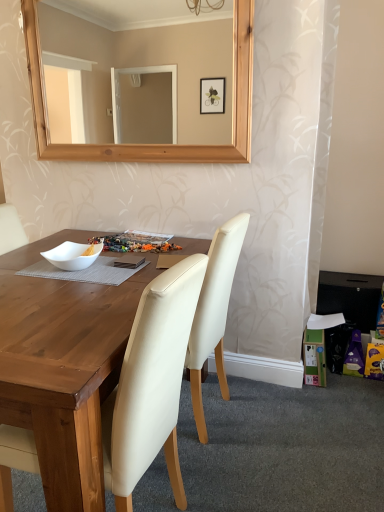
Question: In which direction should I rotate to look at cream leather chair at center, the second chair viewed from the front?

Choices:
 (A) right
 (B) left

Answer: (B)

Question: Considering the relative sizes of cream leather chair at center, which is counted as the first chair, starting from the front, and cream leather chair at center, the first chair viewed from the back, in the image provided, is cream leather chair at center, which is counted as the first chair, starting from the front, smaller than cream leather chair at center, the first chair viewed from the back,?

Choices:
 (A) yes
 (B) no

Answer: (B)

Question: Is cream leather chair at center, which is counted as the first chair, starting from the front, aimed at cream leather chair at center, the second chair viewed from the front?

Choices:
 (A) no
 (B) yes

Answer: (A)

Question: From a real-world perspective, is cream leather chair at center, arranged as the 2th chair when viewed from the back, over cream leather chair at center, the second chair viewed from the front?

Choices:
 (A) yes
 (B) no

Answer: (A)

Question: Is cream leather chair at center, which is counted as the first chair, starting from the front, far from cream leather chair at center, the first chair viewed from the back?

Choices:
 (A) no
 (B) yes

Answer: (A)

Question: Considering the relative sizes of cream leather chair at center, which is counted as the first chair, starting from the front, and cream leather chair at center, the second chair viewed from the front, in the image provided, is cream leather chair at center, which is counted as the first chair, starting from the front, thinner than cream leather chair at center, the second chair viewed from the front,?

Choices:
 (A) yes
 (B) no

Answer: (A)

Question: Is cream leather chair at center, which is counted as the first chair, starting from the front, closer to camera compared to cream leather chair at center, the second chair viewed from the front?

Choices:
 (A) yes
 (B) no

Answer: (A)

Question: Does white matte bowl at center have a larger size compared to cream leather chair at center, the first chair viewed from the back?

Choices:
 (A) no
 (B) yes

Answer: (A)

Question: From the image's perspective, does white matte bowl at center appear higher than cream leather chair at center, the first chair viewed from the back?

Choices:
 (A) no
 (B) yes

Answer: (B)

Question: Is white matte bowl at center facing away from cream leather chair at center, the first chair viewed from the back?

Choices:
 (A) no
 (B) yes

Answer: (A)

Question: Is white matte bowl at center next to cream leather chair at center, the second chair viewed from the front?

Choices:
 (A) yes
 (B) no

Answer: (B)

Question: From a real-world perspective, is white matte bowl at center on top of cream leather chair at center, the first chair viewed from the back?

Choices:
 (A) no
 (B) yes

Answer: (B)

Question: Can you confirm if white matte bowl at center is taller than cream leather chair at center, the second chair viewed from the front?

Choices:
 (A) yes
 (B) no

Answer: (B)

Question: Is cream leather chair at center, the second chair viewed from the front, turned away from white matte bowl at center?

Choices:
 (A) no
 (B) yes

Answer: (A)